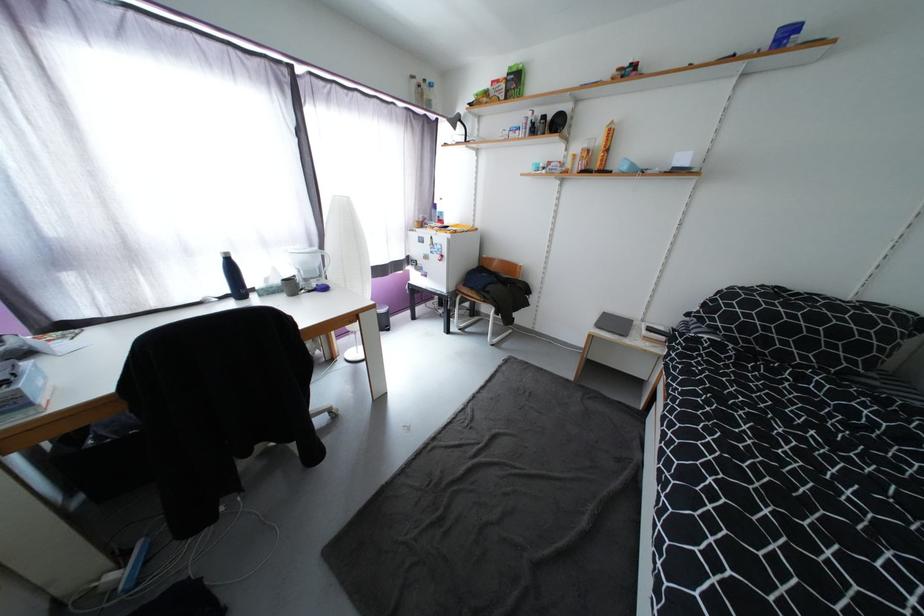
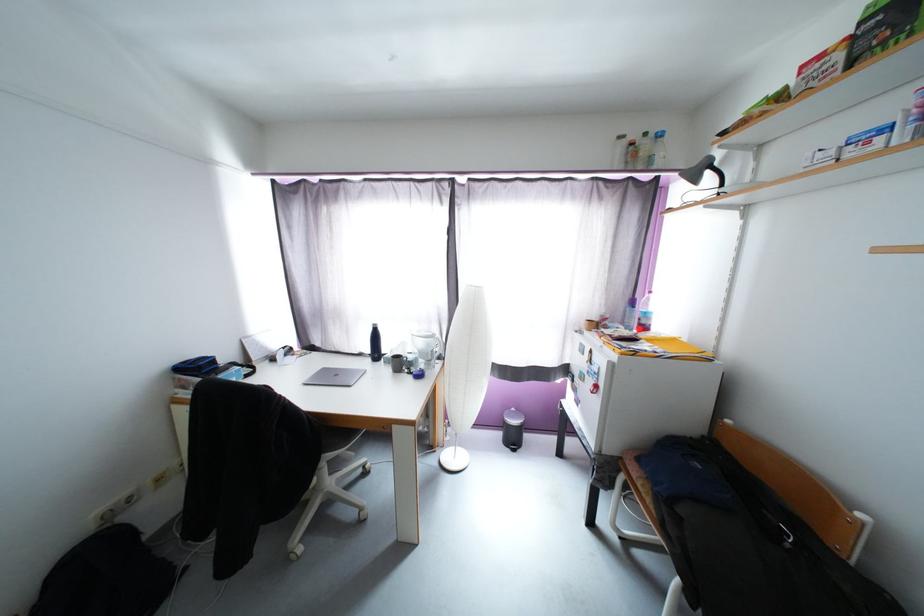
In the second image, find the point that corresponds to pixel 335 411 in the first image.

(367, 511)